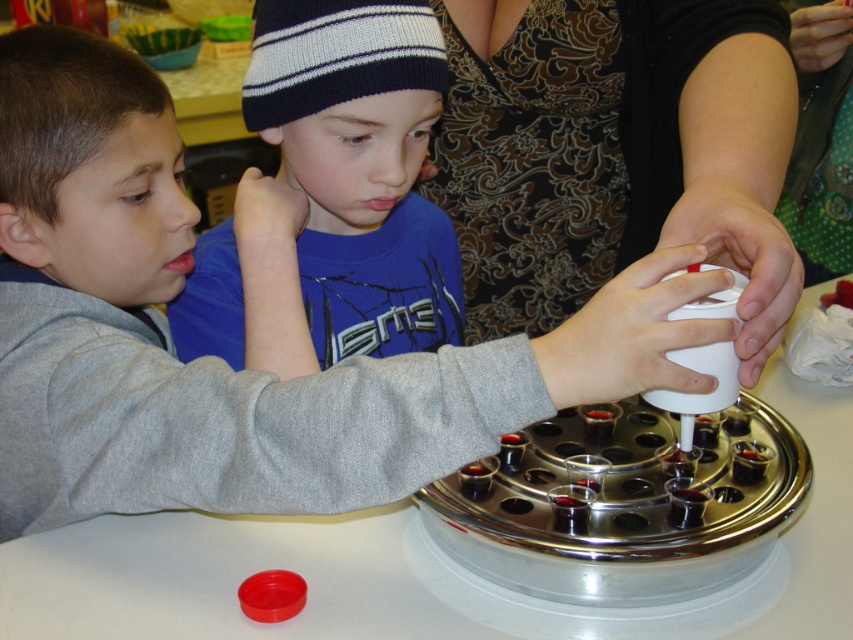
Does patterned fabric dress at upper center lie in front of blue knit hat at upper center?

Yes, it is.

Does point (735, 252) come farther from viewer compared to point (293, 292)?

No.

Where is `patterned fabric dress at upper center`? patterned fabric dress at upper center is located at coordinates (616, 154).

Looking at this image, between smooth white cup at center and blue knit hat at upper center, which one has more height?

smooth white cup at center is taller.

Who is lower down, smooth white cup at center or blue knit hat at upper center?

smooth white cup at center is below.

This screenshot has width=853, height=640. Identify the location of smooth white cup at center. (219, 358).

Between smooth white cup at center and patterned fabric dress at upper center, which one has less height?

Standing shorter between the two is patterned fabric dress at upper center.

Is smooth white cup at center smaller than patterned fabric dress at upper center?

No.

Does point (637, 355) come in front of point (572, 244)?

That is True.

Image resolution: width=853 pixels, height=640 pixels. Find the location of `smooth white cup at center`. smooth white cup at center is located at coordinates (219, 358).